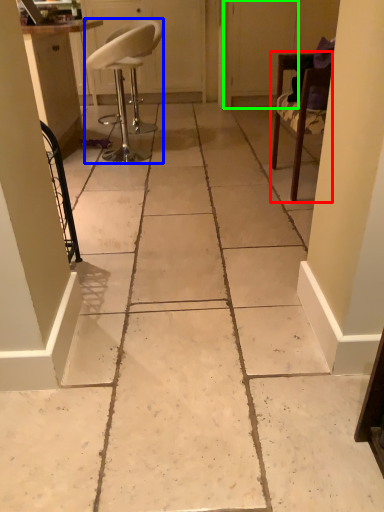
Question: Estimate the real-world distances between objects in this image. Which object is farther from chair (highlighted by a red box), chair (highlighted by a blue box) or screen door (highlighted by a green box)?

Choices:
 (A) chair
 (B) screen door

Answer: (B)